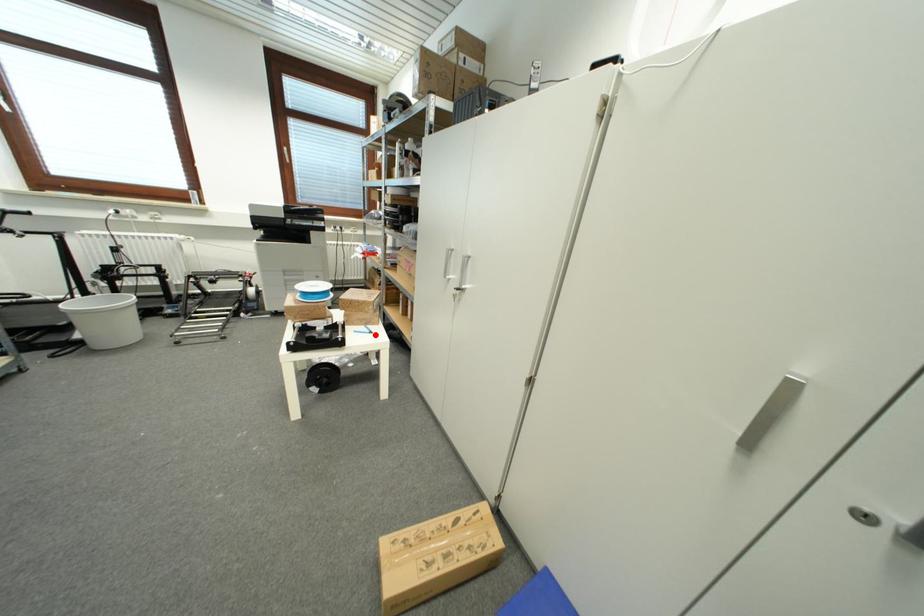
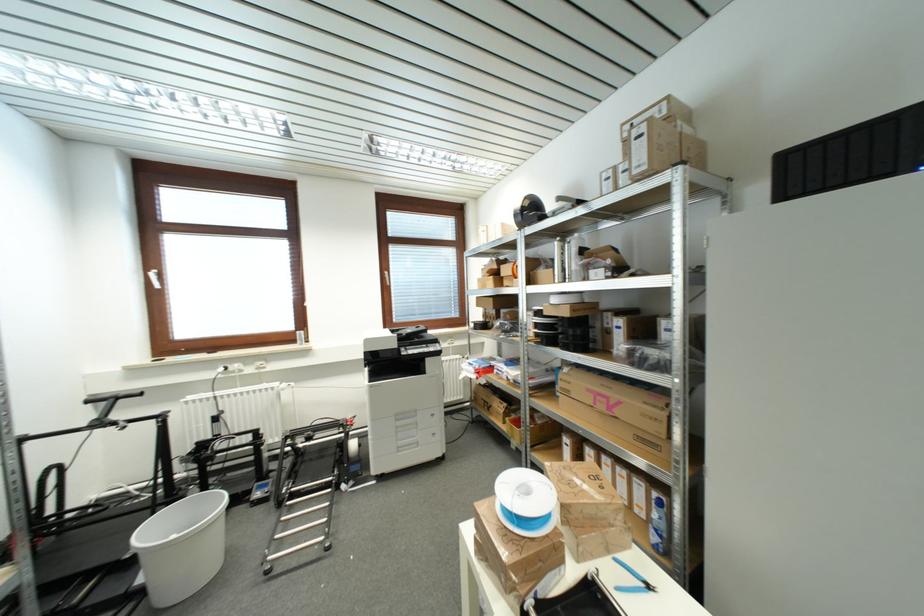
Find the pixel in the second image that matches the highlighted location in the first image.

(652, 590)